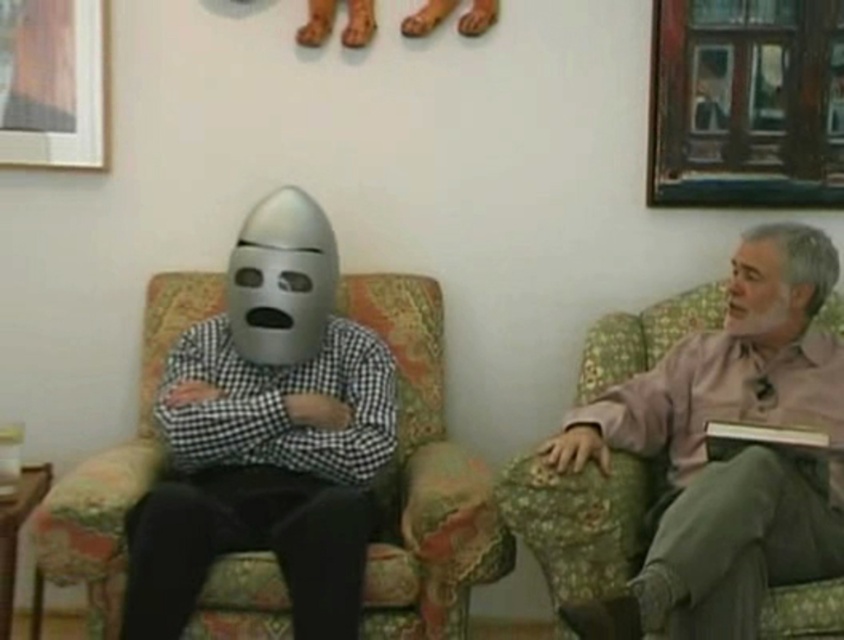
You are an interior designer assessing the space between the wooden framed picture at upper right and the floral fabric armchair at right. Can you determine which object takes up more visual space in the room?

The wooden framed picture at upper right is smaller than the floral fabric armchair at right, so the floral fabric armchair at right takes up more visual space in the room.

You are a delivery person who needs to hand over a package to the person wearing a metallic helmet mask. The delivery requires maintaining a safe distance of at least 6 feet. Can you safely approach the person wearing the metallic helmet mask if you are currently standing at the point marked as point (447, 502)?

The distance between you and the person wearing the metallic helmet mask is 7.03 feet, which is more than the required 6 feet. Therefore, you can safely approach them while maintaining the safe distance.